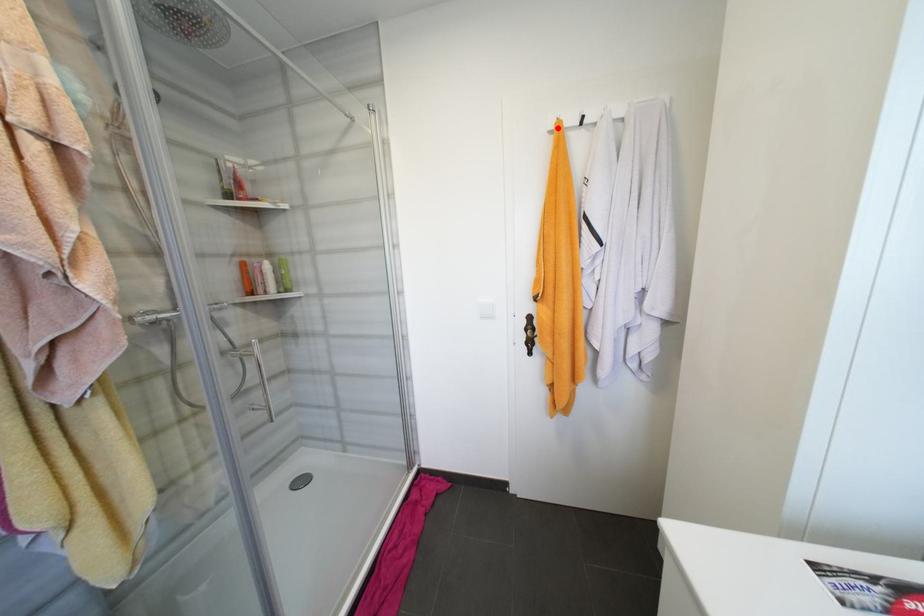
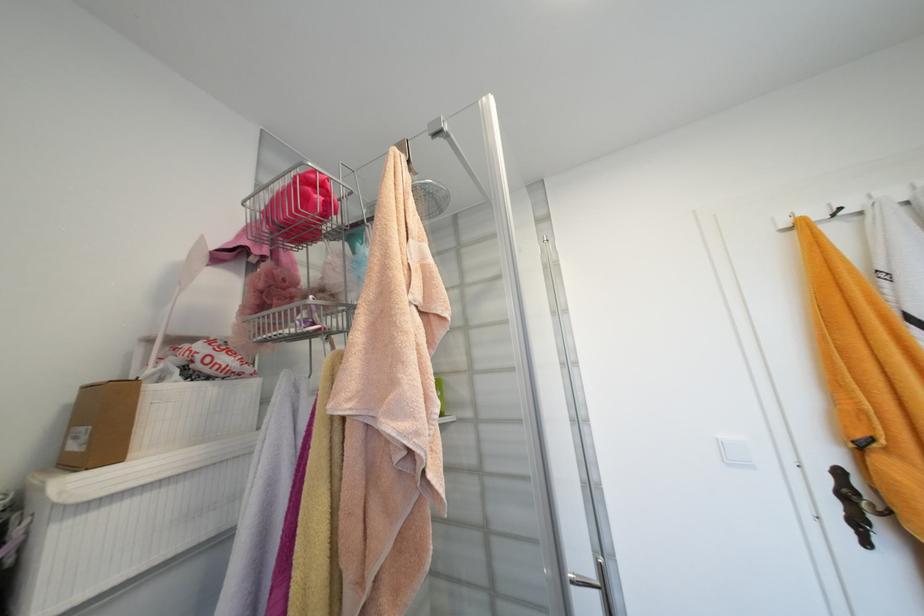
Find the pixel in the second image that matches the highlighted location in the first image.

(792, 225)